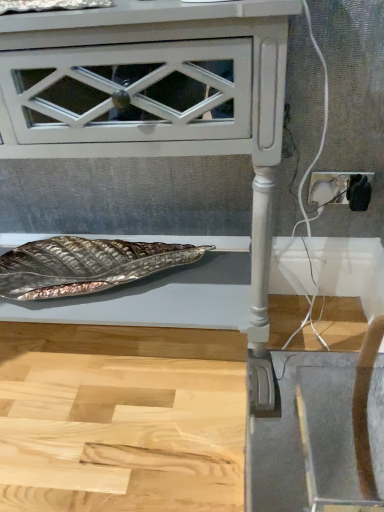
Question: Considering the positions of point (365, 199) and point (172, 53), is point (365, 199) closer or farther from the camera than point (172, 53)?

Choices:
 (A) farther
 (B) closer

Answer: (A)

Question: Considering the positions of white plastic socket at right and white glossy leaf tray at lower center in the image, is white plastic socket at right bigger or smaller than white glossy leaf tray at lower center?

Choices:
 (A) big
 (B) small

Answer: (B)

Question: From a real-world perspective, relative to white glossy leaf tray at lower center, is white plastic socket at right vertically above or below?

Choices:
 (A) above
 (B) below

Answer: (B)

Question: Is white glossy leaf tray at lower center taller or shorter than white plastic socket at right?

Choices:
 (A) short
 (B) tall

Answer: (B)

Question: From the image's perspective, is white glossy leaf tray at lower center located above or below white plastic socket at right?

Choices:
 (A) above
 (B) below

Answer: (B)

Question: Is white glossy leaf tray at lower center in front of or behind white plastic socket at right in the image?

Choices:
 (A) behind
 (B) front

Answer: (B)

Question: Is white glossy leaf tray at lower center spatially inside white plastic socket at right, or outside of it?

Choices:
 (A) outside
 (B) inside

Answer: (A)